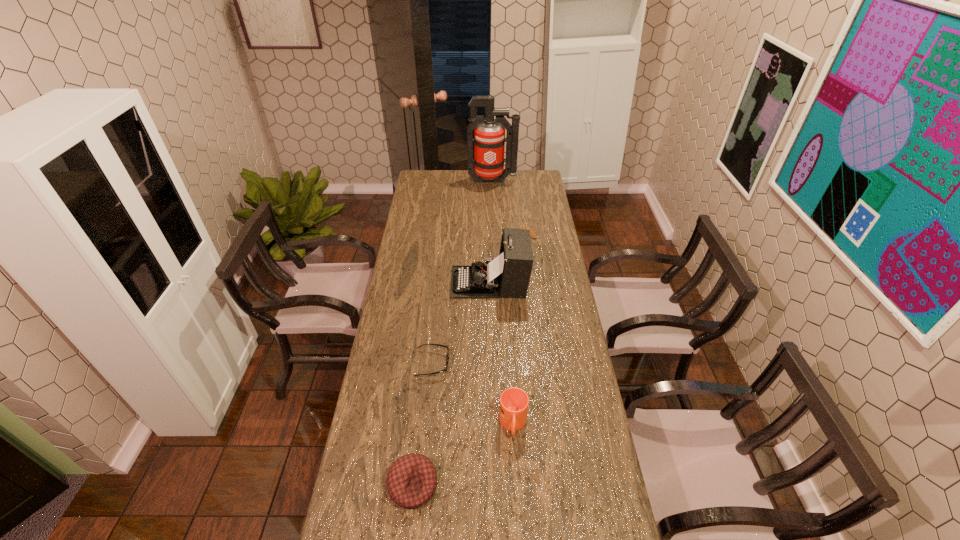
Where is `the farthest object`? This screenshot has width=960, height=540. the farthest object is located at coordinates (489, 139).

Where is `the tallest object`? The width and height of the screenshot is (960, 540). the tallest object is located at coordinates (489, 139).

Find the location of a particular element. the second tallest object is located at coordinates (508, 275).

Locate an element on the screen. the third farthest object is located at coordinates (508, 275).

Find the location of a particular element. the fourth shortest object is located at coordinates (514, 402).

The height and width of the screenshot is (540, 960). Identify the location of mug. (514, 402).

I want to click on the nearest object, so click(x=411, y=481).

Locate an element on the screen. The width and height of the screenshot is (960, 540). the fourth tallest object is located at coordinates (411, 481).

You are a GUI agent. You are given a task and a screenshot of the screen. Output one action in this format:
    pyautogui.click(x=<x>, y=<y>)
    Task: Click on the crescent roll
    This screenshot has width=960, height=540.
    Given the screenshot: What is the action you would take?
    pos(532,233)

At what (x,y) coordinates should I click in order to perform the action: click on the fifth nearest object. Please return your answer as a coordinate pair (x, y). The width and height of the screenshot is (960, 540). Looking at the image, I should click on (x=532, y=233).